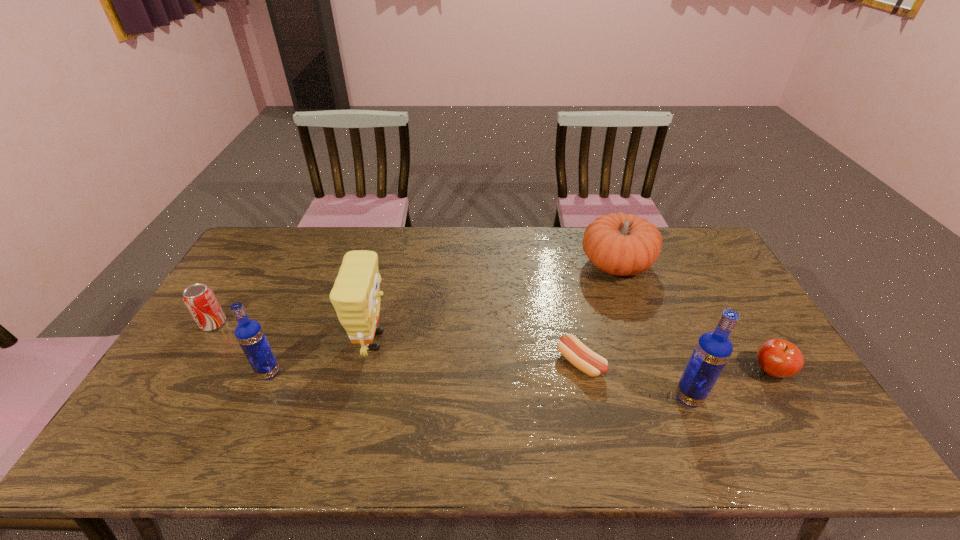
This screenshot has height=540, width=960. Identify the location of the farther vodka. (249, 333).

Identify the location of the sixth object from right to left. (249, 333).

Locate an element on the screen. The width and height of the screenshot is (960, 540). the nearer vodka is located at coordinates [713, 349].

Identify the location of the right vodka. This screenshot has width=960, height=540. (713, 349).

Locate an element on the screen. Image resolution: width=960 pixels, height=540 pixels. the leftmost object is located at coordinates (200, 300).

Locate an element on the screen. The width and height of the screenshot is (960, 540). soda can is located at coordinates (200, 300).

Locate an element on the screen. This screenshot has height=540, width=960. the farthest object is located at coordinates (620, 244).

Find the location of `pumpkin`. pumpkin is located at coordinates (620, 244).

Find the location of a particular element. This screenshot has height=540, width=960. sponge is located at coordinates (356, 293).

You are a GUI agent. You are given a task and a screenshot of the screen. Output one action in this format:
    pyautogui.click(x=<x>, y=<y>)
    Task: Click on the second shortest object
    
    Given the screenshot: What is the action you would take?
    pyautogui.click(x=779, y=358)